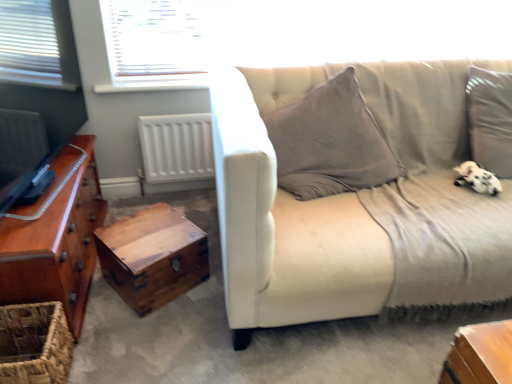
Question: From a real-world perspective, is shiny brown wooden chest of drawers at left under wooden chest at lower left?

Choices:
 (A) yes
 (B) no

Answer: (B)

Question: Can you confirm if shiny brown wooden chest of drawers at left is smaller than wooden chest at lower left?

Choices:
 (A) no
 (B) yes

Answer: (A)

Question: From a real-world perspective, is shiny brown wooden chest of drawers at left located higher than wooden chest at lower left?

Choices:
 (A) no
 (B) yes

Answer: (B)

Question: Is shiny brown wooden chest of drawers at left next to wooden chest at lower left and touching it?

Choices:
 (A) yes
 (B) no

Answer: (B)

Question: Does shiny brown wooden chest of drawers at left appear on the right side of wooden chest at lower left?

Choices:
 (A) no
 (B) yes

Answer: (A)

Question: Does shiny brown wooden chest of drawers at left turn towards wooden chest at lower left?

Choices:
 (A) yes
 (B) no

Answer: (A)

Question: Does gray corduroy couch at right have a greater width compared to shiny brown wooden chest of drawers at left?

Choices:
 (A) yes
 (B) no

Answer: (A)

Question: Is gray corduroy couch at right positioned in front of shiny brown wooden chest of drawers at left?

Choices:
 (A) no
 (B) yes

Answer: (B)

Question: Is shiny brown wooden chest of drawers at left inside gray corduroy couch at right?

Choices:
 (A) no
 (B) yes

Answer: (A)

Question: Is gray corduroy couch at right placed right next to shiny brown wooden chest of drawers at left?

Choices:
 (A) no
 (B) yes

Answer: (A)

Question: Is gray corduroy couch at right aimed at shiny brown wooden chest of drawers at left?

Choices:
 (A) no
 (B) yes

Answer: (A)

Question: Is gray corduroy couch at right further to the viewer compared to shiny brown wooden chest of drawers at left?

Choices:
 (A) no
 (B) yes

Answer: (A)

Question: Does woven brown basket at lower left have a larger size compared to white fluffy dog at lower right?

Choices:
 (A) no
 (B) yes

Answer: (B)